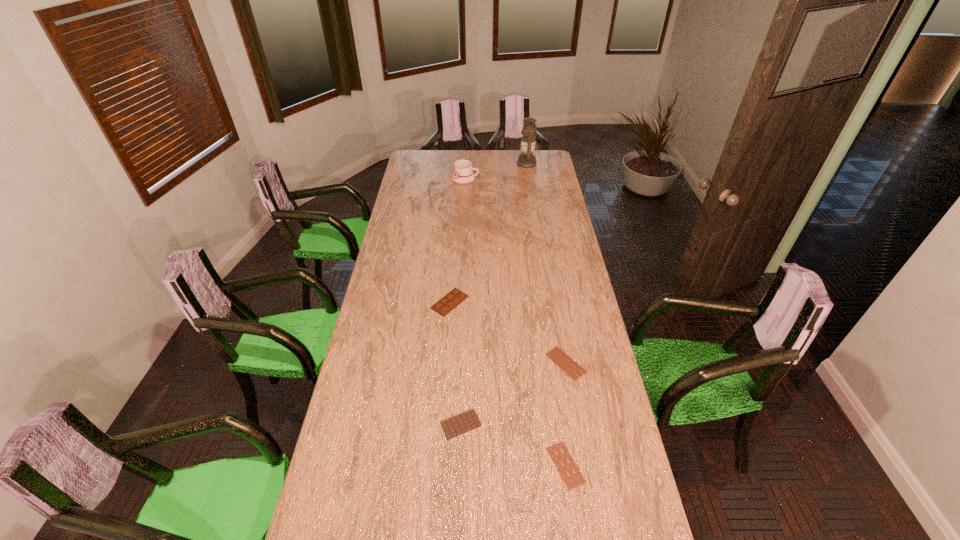
At what (x,y) coordinates should I click in order to perform the action: click on vacant point located on the left of the farthest object. Please return your answer as a coordinate pair (x, y). The image size is (960, 540). Looking at the image, I should click on (480, 164).

The height and width of the screenshot is (540, 960). Identify the location of vacant space situated on the side with the handle of the second farthest object. (541, 179).

This screenshot has height=540, width=960. I want to click on vacant area situated 0.140m on the right of the third farthest object, so click(502, 302).

You are a GUI agent. You are given a task and a screenshot of the screen. Output one action in this format:
    pyautogui.click(x=<x>, y=<y>)
    Task: Click on the vacant space located on the left of the third shortest chocolate bar
    The height and width of the screenshot is (540, 960).
    Given the screenshot: What is the action you would take?
    pyautogui.click(x=370, y=424)

Where is `free space located 0.280m on the front of the second farthest chocolate bar`? The image size is (960, 540). free space located 0.280m on the front of the second farthest chocolate bar is located at coordinates (583, 458).

At what (x,y) coordinates should I click in order to perform the action: click on free space located on the left of the nearest chocolate bar. Please return your answer as a coordinate pair (x, y). Looking at the image, I should click on (437, 465).

Locate an element on the screen. The height and width of the screenshot is (540, 960). object that is at the far edge is located at coordinates (528, 143).

The width and height of the screenshot is (960, 540). What are the coordinates of `oil lamp that is at the right edge` in the screenshot? It's located at (528, 143).

Image resolution: width=960 pixels, height=540 pixels. Find the location of `object at the far right corner`. object at the far right corner is located at coordinates (528, 143).

You are a GUI agent. You are given a task and a screenshot of the screen. Output one action in this format:
    pyautogui.click(x=<x>, y=<y>)
    Task: Click on the blank space at the far edge of the desktop
    The height and width of the screenshot is (540, 960).
    Given the screenshot: What is the action you would take?
    pyautogui.click(x=455, y=153)